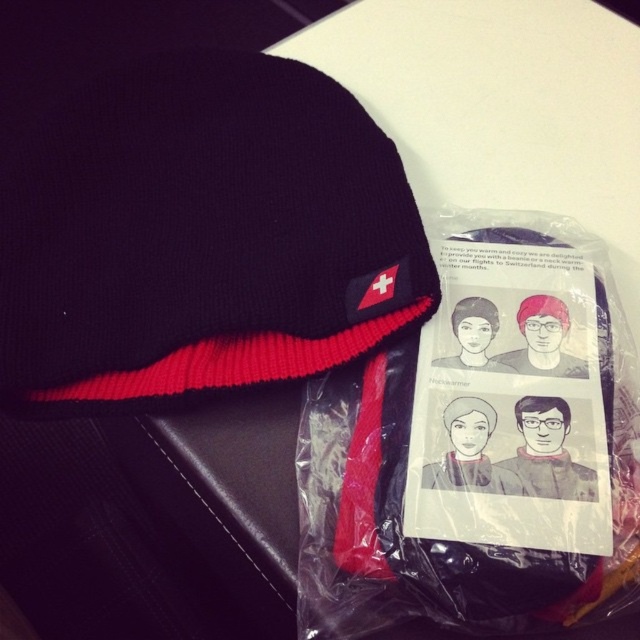
Who is positioned more to the right, black knitted beanie at center or matte plastic bag at center?

From the viewer's perspective, matte plastic bag at center appears more on the right side.

Image resolution: width=640 pixels, height=640 pixels. What do you see at coordinates (202, 234) in the screenshot?
I see `black knitted beanie at center` at bounding box center [202, 234].

The image size is (640, 640). What are the coordinates of `black knitted beanie at center` in the screenshot? It's located at (202, 234).

Who is positioned more to the right, matte plastic bag at center or matte black beanie at upper center?

Positioned to the right is matte black beanie at upper center.

Who is taller, matte plastic bag at center or matte black beanie at upper center?

matte plastic bag at center

Which is in front, point (304, 532) or point (525, 324)?

Positioned in front is point (304, 532).

This screenshot has height=640, width=640. Find the location of `matte plastic bag at center`. matte plastic bag at center is located at coordinates (477, 449).

Is black knitted beanie at center bigger than matte black beanie at upper center?

Correct, black knitted beanie at center is larger in size than matte black beanie at upper center.

Who is more forward, (218, 349) or (531, 301)?

Point (531, 301)

Find the location of `black knitted beanie at center`. black knitted beanie at center is located at coordinates (202, 234).